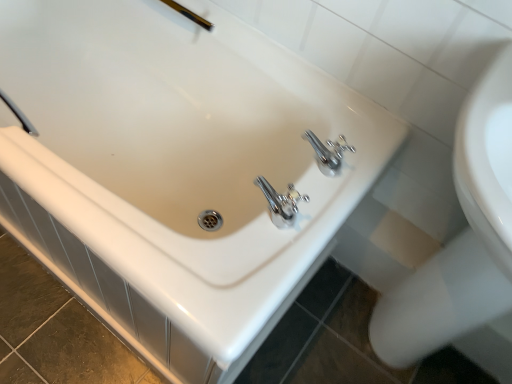
You are a GUI agent. You are given a task and a screenshot of the screen. Output one action in this format:
    pyautogui.click(x=<x>, y=<y>)
    Task: Click on the vacant area situated below white glossy sink at upper right (from a real-world perspective)
    
    Given the screenshot: What is the action you would take?
    pyautogui.click(x=357, y=339)